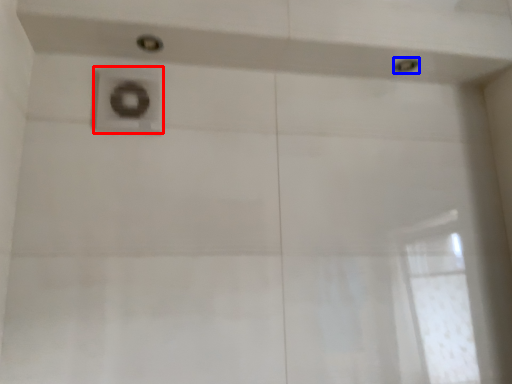
Question: Which object appears closest to the camera in this image, plumbing fixture (highlighted by a red box) or shower (highlighted by a blue box)?

Choices:
 (A) plumbing fixture
 (B) shower

Answer: (A)